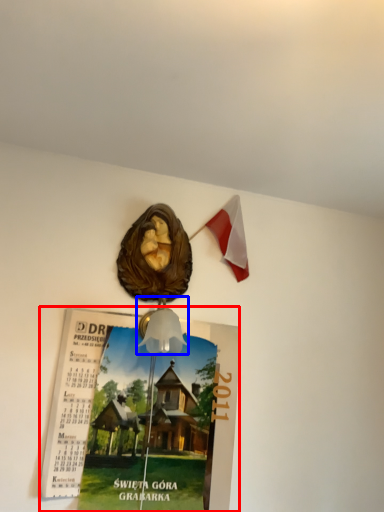
Question: Among these objects, which one is farthest to the camera, poster page (highlighted by a red box) or lamp (highlighted by a blue box)?

Choices:
 (A) poster page
 (B) lamp

Answer: (A)